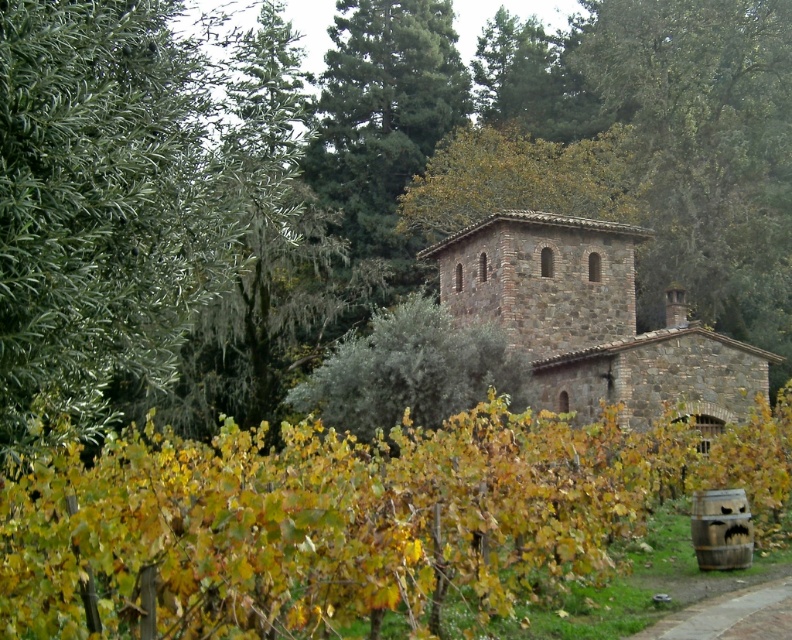
Describe the element at coordinates (351, 520) in the screenshot. I see `green leafy vineyard at center` at that location.

The height and width of the screenshot is (640, 792). What are the coordinates of `green leafy vineyard at center` in the screenshot? It's located at (351, 520).

At what (x,y) coordinates should I click in order to perform the action: click on green leafy vineyard at center. Please return your answer as a coordinate pair (x, y). Looking at the image, I should click on (351, 520).

Identify the location of green leafy vineyard at center. (351, 520).

Can you confirm if green leafy tree at left is smaller than brick paved path at lower right?

No, green leafy tree at left is not smaller than brick paved path at lower right.

Is green leafy tree at left thinner than brick paved path at lower right?

No.

Is point (56, 372) positioned in front of point (680, 625)?

Yes, point (56, 372) is closer to viewer.

Where is `green leafy tree at left`? This screenshot has width=792, height=640. green leafy tree at left is located at coordinates (126, 193).

Who is lower down, green leafy vineyard at center or brick paved path at lower right?

brick paved path at lower right is lower down.

Can you confirm if green leafy vineyard at center is positioned to the left of brick paved path at lower right?

Indeed, green leafy vineyard at center is positioned on the left side of brick paved path at lower right.

This screenshot has width=792, height=640. What do you see at coordinates (351, 520) in the screenshot?
I see `green leafy vineyard at center` at bounding box center [351, 520].

Image resolution: width=792 pixels, height=640 pixels. I want to click on green leafy vineyard at center, so click(x=351, y=520).